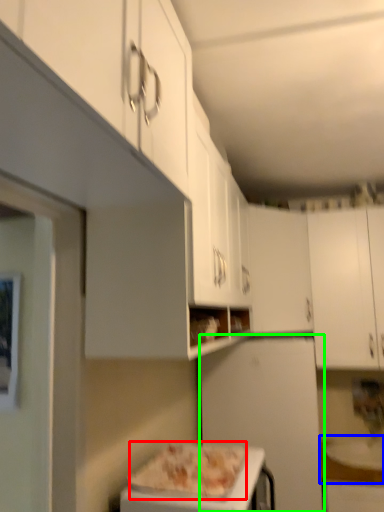
Question: Which object is positioned closest to pizza (highlighted by a red box)? Select from counter top (highlighted by a blue box) and appliance (highlighted by a green box).

Choices:
 (A) counter top
 (B) appliance

Answer: (B)